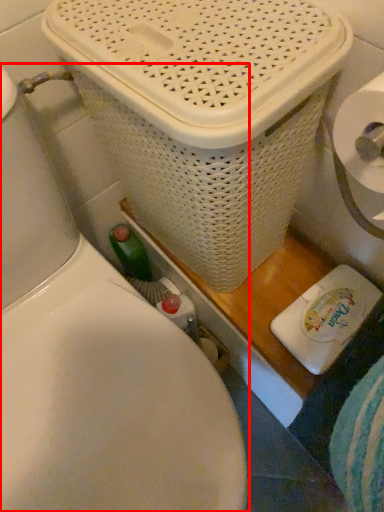
Question: Observing the image, what is the correct spatial positioning of toilet (annotated by the red box) in reference to basket container?

Choices:
 (A) left
 (B) right

Answer: (A)